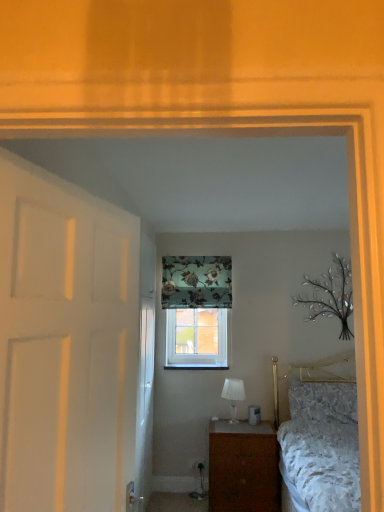
Identify the location of white glass table lamp at center. coord(233,395).

Describe the element at coordinates (196, 282) in the screenshot. I see `floral fabric curtain at upper center` at that location.

What do you see at coordinates (65, 344) in the screenshot?
I see `white matte door at left, positioned as the 1th door in front-to-back order` at bounding box center [65, 344].

Identify the location of white glass table lamp at center. (233, 395).

From the image's perspective, between white glass table lamp at center and fluffy white pillow at lower right, which one is located above?

fluffy white pillow at lower right, from the image's perspective.

How far apart are white glass table lamp at center and fluffy white pillow at lower right?

A distance of 24.53 inches exists between white glass table lamp at center and fluffy white pillow at lower right.

Between point (232, 407) and point (332, 417), which one is positioned in front?

Point (332, 417)

In terms of width, does white glass table lamp at center look wider or thinner when compared to fluffy white pillow at lower right?

Considering their sizes, white glass table lamp at center looks slimmer than fluffy white pillow at lower right.

Looking at their sizes, would you say white glass table lamp at center is wider or thinner than brown wood nightstand at lower right?

In the image, white glass table lamp at center appears to be more narrow than brown wood nightstand at lower right.

Consider the image. Is white glass table lamp at center not within brown wood nightstand at lower right?

That's correct, white glass table lamp at center is outside of brown wood nightstand at lower right.

Is there a large distance between white glass table lamp at center and brown wood nightstand at lower right?

No, white glass table lamp at center is not far away from brown wood nightstand at lower right.

From the image's perspective, which is above, clear glass window at center or white glass table lamp at center?

clear glass window at center appears higher in the image.

Locate an element on the screen. table lamp beneath the clear glass window at center (from a real-world perspective) is located at coordinates (233, 395).

Who is smaller, clear glass window at center or white glass table lamp at center?

With smaller size is white glass table lamp at center.

From the brown wood nightstand at lower right, count the 1st door to the left and point to it. Please provide its 2D coordinates.

[(65, 344)]

Consider the image. Is brown wood nightstand at lower right further to the viewer compared to white matte door at left, the 2th door when ordered from back to front?

Yes, the depth of brown wood nightstand at lower right is greater than that of white matte door at left, the 2th door when ordered from back to front.

Could you measure the distance between brown wood nightstand at lower right and white matte door at left, the 2th door when ordered from back to front?

brown wood nightstand at lower right is 8.47 feet from white matte door at left, the 2th door when ordered from back to front.

Measure the distance from white glossy door at left, placed as the first door when sorted from back to front, to brown wood nightstand at lower right.

white glossy door at left, placed as the first door when sorted from back to front, and brown wood nightstand at lower right are 3.91 feet apart.

Is point (150, 367) behind point (214, 499)?

Yes.

Is white glossy door at left, placed as the first door when sorted from back to front, beside brown wood nightstand at lower right?

No.

Is white glossy door at left, placed as the first door when sorted from back to front, shorter than brown wood nightstand at lower right?

No, white glossy door at left, placed as the first door when sorted from back to front, is not shorter than brown wood nightstand at lower right.

How many degrees apart are the facing directions of floral fabric curtain at upper center and white glass table lamp at center?

There is a 0.719-degree angle between the facing directions of floral fabric curtain at upper center and white glass table lamp at center.

Is floral fabric curtain at upper center far away from white glass table lamp at center?

floral fabric curtain at upper center is actually quite close to white glass table lamp at center.

From the image's perspective, is floral fabric curtain at upper center below white glass table lamp at center?

No, from the image's perspective, floral fabric curtain at upper center is not below white glass table lamp at center.

Considering the sizes of objects floral fabric curtain at upper center and white glass table lamp at center in the image provided, who is shorter, floral fabric curtain at upper center or white glass table lamp at center?

With less height is white glass table lamp at center.

Could you tell me if fluffy white pillow at lower right is facing floral fabric curtain at upper center?

No, fluffy white pillow at lower right is not turned towards floral fabric curtain at upper center.

From a real-world perspective, is fluffy white pillow at lower right above or below floral fabric curtain at upper center?

From a real-world perspective, fluffy white pillow at lower right is physically below floral fabric curtain at upper center.

Is fluffy white pillow at lower right at the right side of floral fabric curtain at upper center?

Correct, you'll find fluffy white pillow at lower right to the right of floral fabric curtain at upper center.

Who is bigger, fluffy white pillow at lower right or floral fabric curtain at upper center?

fluffy white pillow at lower right.

I want to click on table lamp below the fluffy white pillow at lower right (from the image's perspective), so click(x=233, y=395).

At what (x,y) coordinates should I click in order to perform the action: click on nightstand that appears on the right of white glass table lamp at center. Please return your answer as a coordinate pair (x, y). Looking at the image, I should click on (243, 467).

Looking at the image, which one is located further to white glossy door at left, positioned as the second door in front-to-back order, clear glass window at center or white matte door at left, the 2th door when ordered from back to front?

Among the two, white matte door at left, the 2th door when ordered from back to front, is located further to white glossy door at left, positioned as the second door in front-to-back order.

Looking at this image, based on their spatial positions, is white glass table lamp at center or brown wood nightstand at lower right further from white matte door at left, the 2th door when ordered from back to front?

white glass table lamp at center is positioned further to the anchor white matte door at left, the 2th door when ordered from back to front.

Based on their spatial positions, is white glass table lamp at center or fluffy white pillow at lower right further from brown wood nightstand at lower right?

fluffy white pillow at lower right is positioned further to the anchor brown wood nightstand at lower right.

Which object lies nearer to the anchor point brown wood nightstand at lower right, clear glass window at center or white matte door at left, positioned as the 1th door in front-to-back order?

clear glass window at center is positioned closer to the anchor brown wood nightstand at lower right.

Estimate the real-world distances between objects in this image. Which object is further from fluffy white pillow at lower right, brown wood nightstand at lower right or white matte door at left, the 2th door when ordered from back to front?

Among the two, white matte door at left, the 2th door when ordered from back to front, is located further to fluffy white pillow at lower right.

Which object lies nearer to the anchor point white glossy door at left, placed as the first door when sorted from back to front, brown wood nightstand at lower right or white glass table lamp at center?

Based on the image, white glass table lamp at center appears to be nearer to white glossy door at left, placed as the first door when sorted from back to front.

Based on their spatial positions, is fluffy white pillow at lower right or brown wood nightstand at lower right closer to clear glass window at center?

brown wood nightstand at lower right.

Estimate the real-world distances between objects in this image. Which object is further from clear glass window at center, fluffy white pillow at lower right or floral fabric curtain at upper center?

Based on the image, fluffy white pillow at lower right appears to be further to clear glass window at center.

Where is `door located between white matte door at left, the 2th door when ordered from back to front, and floral fabric curtain at upper center in the depth direction`? This screenshot has height=512, width=384. door located between white matte door at left, the 2th door when ordered from back to front, and floral fabric curtain at upper center in the depth direction is located at coordinates (145, 402).

Where is `door located between white matte door at left, positioned as the 1th door in front-to-back order, and brown wood nightstand at lower right in the depth direction`? The width and height of the screenshot is (384, 512). door located between white matte door at left, positioned as the 1th door in front-to-back order, and brown wood nightstand at lower right in the depth direction is located at coordinates (145, 402).

Image resolution: width=384 pixels, height=512 pixels. I want to click on curtain positioned between white glossy door at left, placed as the first door when sorted from back to front, and clear glass window at center from near to far, so click(196, 282).

The height and width of the screenshot is (512, 384). I want to click on table lamp between white glossy door at left, positioned as the second door in front-to-back order, and fluffy white pillow at lower right, in the horizontal direction, so click(x=233, y=395).